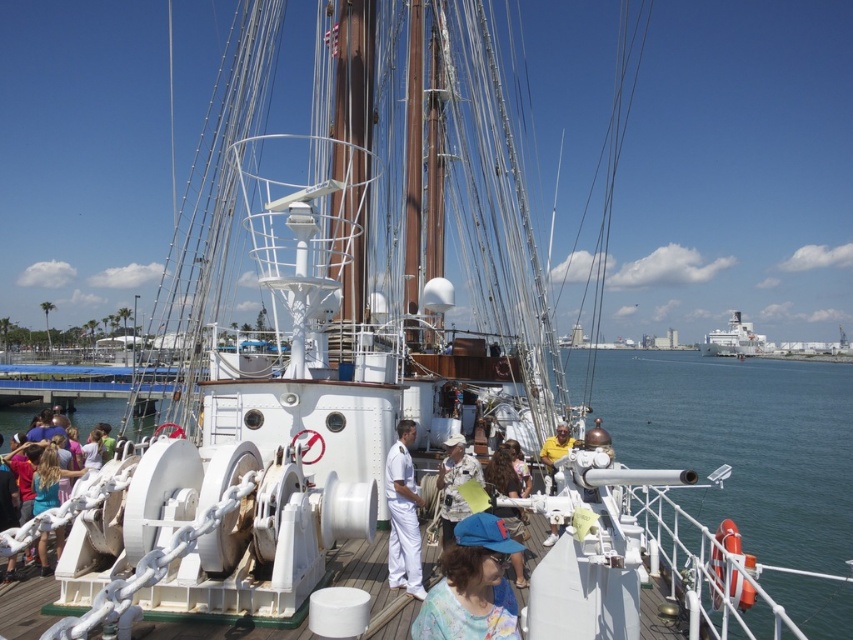
Is point (401, 449) positioned after point (10, 451)?

No, it is in front of (10, 451).

Does white uniform at center have a greater width compared to white chain at lower left?

No.

Is point (407, 552) positioned in front of point (10, 461)?

That is True.

This screenshot has height=640, width=853. Find the location of `white uniform at center`. white uniform at center is located at coordinates (403, 515).

Is point (788, 369) behind point (546, 461)?

Yes, point (788, 369) is behind point (546, 461).

Does clear blue water at center have a smaller size compared to yellow fabric shirt at center?

Actually, clear blue water at center might be larger than yellow fabric shirt at center.

Who is more forward, (672, 376) or (556, 531)?

Point (556, 531) is in front.

The image size is (853, 640). I want to click on clear blue water at center, so click(737, 440).

Between point (450, 630) and point (448, 452), which one is positioned in front?

Point (450, 630) is in front.

This screenshot has height=640, width=853. Find the location of `blue fabric cap at center`. blue fabric cap at center is located at coordinates (471, 586).